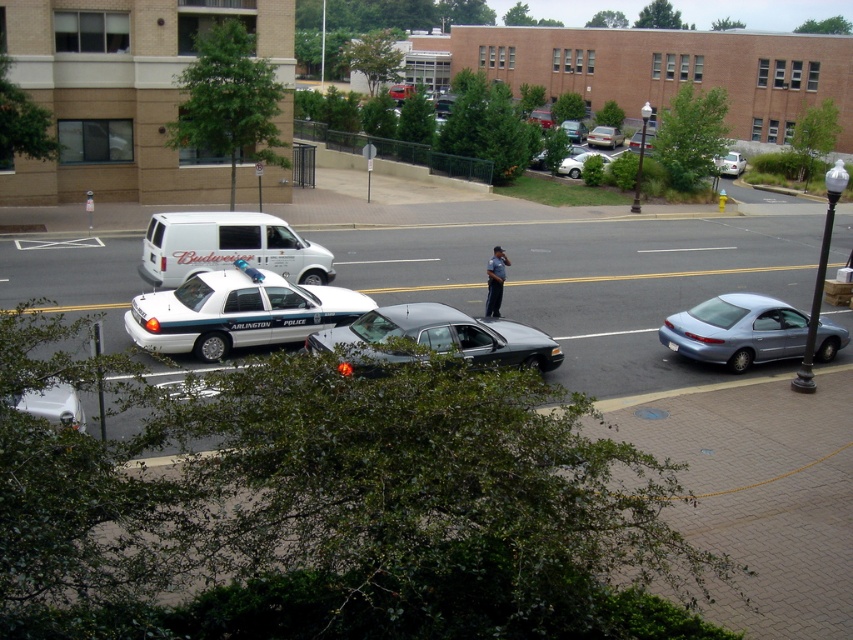
Which is below, metallic silver car at center or metallic silver sedan at center?

metallic silver car at center

Does metallic silver car at center appear under metallic silver sedan at center?

Indeed, metallic silver car at center is positioned under metallic silver sedan at center.

Between point (567, 321) and point (567, 122), which one is positioned behind?

The point (567, 122) is behind.

Locate an element on the screen. This screenshot has height=640, width=853. metallic silver car at center is located at coordinates (590, 282).

Can you confirm if dark blue uniform at center is positioned to the right of white matte sedan at upper right?

No, dark blue uniform at center is not to the right of white matte sedan at upper right.

Does dark blue uniform at center lie in front of white matte sedan at upper right?

That is True.

Which is in front, point (502, 256) or point (718, 170)?

Point (502, 256) is in front.

You are a GUI agent. You are given a task and a screenshot of the screen. Output one action in this format:
    pyautogui.click(x=<x>, y=<y>)
    Task: Click on the dark blue uniform at center
    This screenshot has height=640, width=853.
    Given the screenshot: What is the action you would take?
    pyautogui.click(x=495, y=282)

Is point (509, 268) positioned in front of point (589, 138)?

That is True.

Consider the image. Can you confirm if metallic silver car at center is shorter than silver metallic sedan at center?

No.

Which is behind, point (363, 280) or point (599, 145)?

The point (599, 145) is behind.

Identify the location of metallic silver car at center. (590, 282).